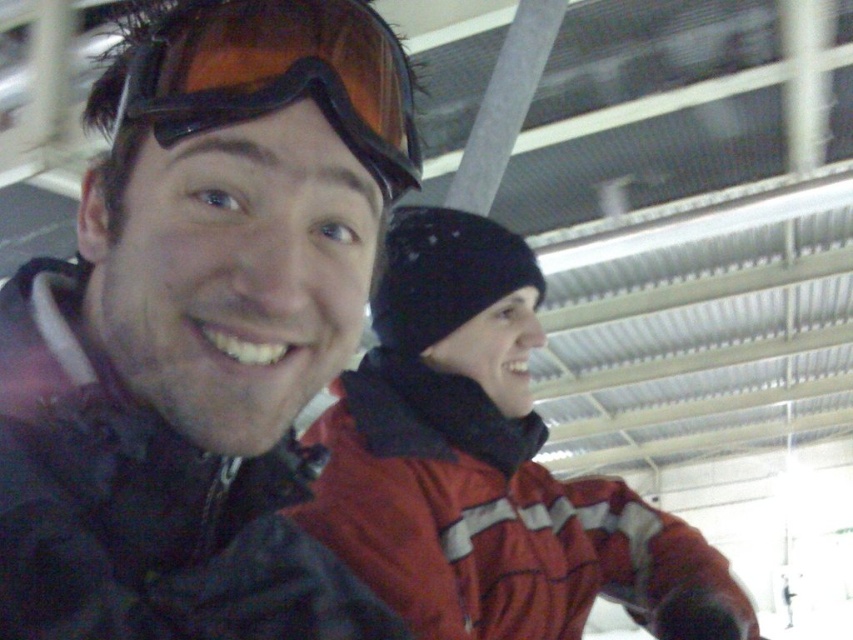
You are a photographer trying to capture both the matte black jacket at left and the matte orange ski goggles at upper left in a single frame. Based on their positions, which object should you focus on first to ensure both are in the frame?

The matte black jacket at left is below the matte orange ski goggles at upper left, so you should focus on the matte orange ski goggles at upper left first to ensure both are in the frame.

You are standing in the snow with two points marked in the scene. The first point is at coordinates point (399, 260) and the second is at point (138, 51). Which point is closer to you?

Point (399, 260) is further to the camera than point (138, 51), so the closer point to you is point (138, 51).